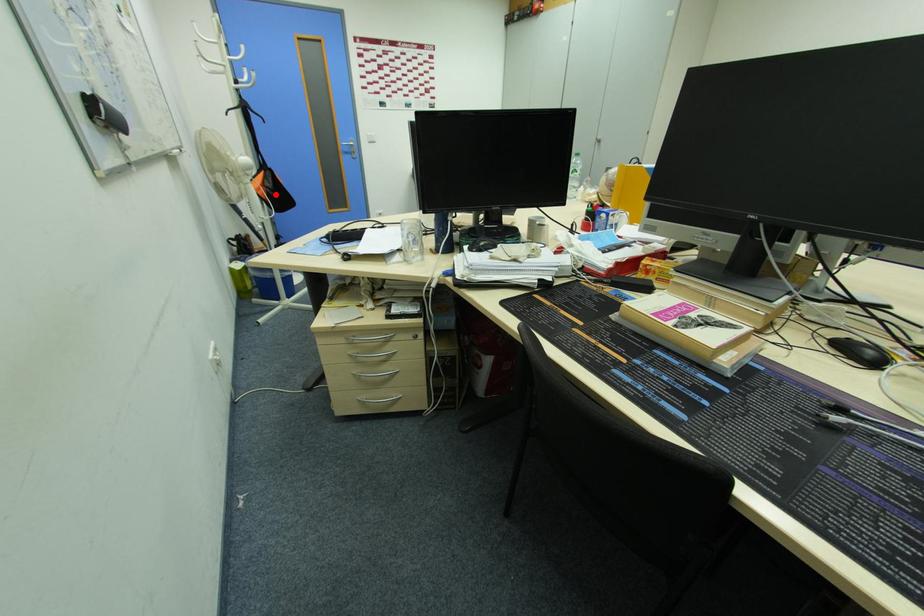
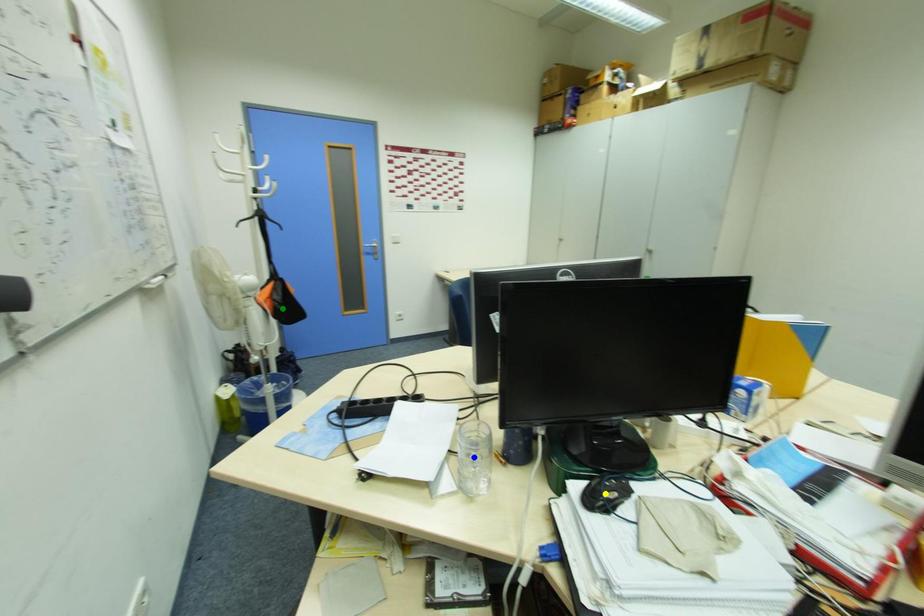
Question: I am providing you with two images of the same scene from different viewpoints. A red point is marked on the first image. You are given multiple points on the second image. Which spot in image 2 lines up with the point in image 1?

Choices:
 (A) green point
 (B) yellow point
 (C) blue point

Answer: (A)